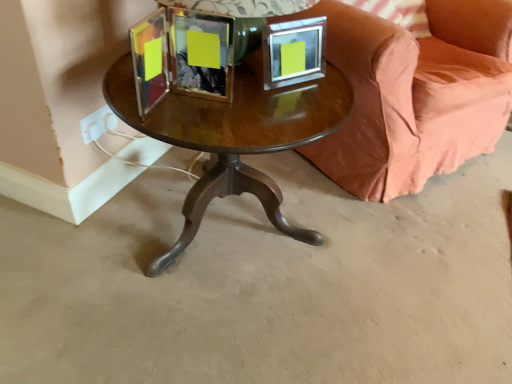
In order to face pink fabric pillow at upper right, should I rotate leftwards or rightwards?

To align with it, rotate right about 18.550°.

This screenshot has width=512, height=384. What do you see at coordinates (234, 137) in the screenshot? I see `shiny brown wood coffee table at center` at bounding box center [234, 137].

The height and width of the screenshot is (384, 512). Describe the element at coordinates (414, 93) in the screenshot. I see `velvet coral couch at center` at that location.

Where is `brown polished wood table at center`? This screenshot has width=512, height=384. brown polished wood table at center is located at coordinates (265, 285).

Where is `studio couch above the shiny brown wood coffee table at center (from a real-world perspective)`? Image resolution: width=512 pixels, height=384 pixels. studio couch above the shiny brown wood coffee table at center (from a real-world perspective) is located at coordinates (414, 93).

Looking at this image, visually, is velvet coral couch at center positioned to the left or to the right of shiny brown wood coffee table at center?

velvet coral couch at center is to the right of shiny brown wood coffee table at center.

Does velvet coral couch at center have a lesser width compared to shiny brown wood coffee table at center?

In fact, velvet coral couch at center might be wider than shiny brown wood coffee table at center.

Between shiny brown wood coffee table at center and metallic silver picture frame at upper center, which one has more height?

shiny brown wood coffee table at center is taller.

Is shiny brown wood coffee table at center not inside metallic silver picture frame at upper center?

Absolutely, shiny brown wood coffee table at center is external to metallic silver picture frame at upper center.

Between shiny brown wood coffee table at center and metallic silver picture frame at upper center, which one has smaller width?

Thinner between the two is metallic silver picture frame at upper center.

Considering the points (180, 142) and (297, 54), which point is in front, point (180, 142) or point (297, 54)?

Positioned in front is point (180, 142).

Can you confirm if pink fabric pillow at upper right is taller than brown polished wood table at center?

Yes.

Is point (375, 13) closer to camera compared to point (127, 331)?

No, it is behind (127, 331).

From a real-world perspective, between pink fabric pillow at upper right and brown polished wood table at center, who is vertically lower?

brown polished wood table at center.

Would you say velvet coral couch at center is inside or outside brown polished wood table at center?

velvet coral couch at center is spatially situated outside brown polished wood table at center.

Is velvet coral couch at center oriented towards brown polished wood table at center?

No, velvet coral couch at center does not turn towards brown polished wood table at center.

Is velvet coral couch at center at the left side of brown polished wood table at center?

Incorrect, velvet coral couch at center is not on the left side of brown polished wood table at center.

Measure the distance between velvet coral couch at center and brown polished wood table at center.

A distance of 18.50 inches exists between velvet coral couch at center and brown polished wood table at center.

Could you tell me if shiny brown wood coffee table at center is facing brown polished wood table at center?

No, shiny brown wood coffee table at center is not turned towards brown polished wood table at center.

Where is `coffee table that is on the left side of brown polished wood table at center`? Image resolution: width=512 pixels, height=384 pixels. coffee table that is on the left side of brown polished wood table at center is located at coordinates (234, 137).

Considering the relative sizes of shiny brown wood coffee table at center and brown polished wood table at center in the image provided, is shiny brown wood coffee table at center thinner than brown polished wood table at center?

Correct, the width of shiny brown wood coffee table at center is less than that of brown polished wood table at center.

Would you say shiny brown wood coffee table at center is a long distance from brown polished wood table at center?

That's not correct — shiny brown wood coffee table at center is a little close to brown polished wood table at center.

Is point (121, 281) positioned behind point (234, 193)?

No, (121, 281) is in front of (234, 193).

Find the location of `concrete lying below the shiny brown wood coffee table at center (from the image's perspective)`. concrete lying below the shiny brown wood coffee table at center (from the image's perspective) is located at coordinates (265, 285).

Between brown polished wood table at center and shiny brown wood coffee table at center, which one has larger width?

Wider between the two is brown polished wood table at center.

Is brown polished wood table at center inside the boundaries of shiny brown wood coffee table at center, or outside?

brown polished wood table at center is located beyond the bounds of shiny brown wood coffee table at center.

Is brown polished wood table at center oriented away from velvet coral couch at center?

No, velvet coral couch at center is not at the back of brown polished wood table at center.

From a real-world perspective, is brown polished wood table at center positioned above or below velvet coral couch at center?

brown polished wood table at center is situated lower than velvet coral couch at center in the real world.

Based on their positions, is brown polished wood table at center located to the left or right of velvet coral couch at center?

In the image, brown polished wood table at center appears on the left side of velvet coral couch at center.

Where is `studio couch above the brown polished wood table at center (from the image's perspective)`? The height and width of the screenshot is (384, 512). studio couch above the brown polished wood table at center (from the image's perspective) is located at coordinates (414, 93).

At what (x,y) coordinates should I click in order to perform the action: click on studio couch above the shiny brown wood coffee table at center (from a real-world perspective). Please return your answer as a coordinate pair (x, y). Looking at the image, I should click on (414, 93).

The width and height of the screenshot is (512, 384). Find the location of `picture frame above the shiny brown wood coffee table at center (from the image's perspective)`. picture frame above the shiny brown wood coffee table at center (from the image's perspective) is located at coordinates (294, 52).

Estimate the real-world distances between objects in this image. Which object is further from metallic silver picture frame at upper center, shiny brown wood coffee table at center or pink fabric pillow at upper right?

The object further to metallic silver picture frame at upper center is pink fabric pillow at upper right.

Estimate the real-world distances between objects in this image. Which object is further from velvet coral couch at center, shiny brown wood coffee table at center or metallic silver picture frame at upper center?

shiny brown wood coffee table at center lies further to velvet coral couch at center than the other object.

Based on their spatial positions, is velvet coral couch at center or shiny brown wood coffee table at center further from brown polished wood table at center?

shiny brown wood coffee table at center is further to brown polished wood table at center.

Based on their spatial positions, is shiny brown wood coffee table at center or metallic silver picture frame at upper center further from brown polished wood table at center?

metallic silver picture frame at upper center is positioned further to the anchor brown polished wood table at center.

From the image, which object appears to be farther from velvet coral couch at center, shiny brown wood coffee table at center or pink fabric pillow at upper right?

Among the two, shiny brown wood coffee table at center is located further to velvet coral couch at center.

Which object lies nearer to the anchor point pink fabric pillow at upper right, shiny brown wood coffee table at center or velvet coral couch at center?

velvet coral couch at center lies closer to pink fabric pillow at upper right than the other object.

Looking at the image, which one is located further to velvet coral couch at center, brown polished wood table at center or metallic silver picture frame at upper center?

Among the two, metallic silver picture frame at upper center is located further to velvet coral couch at center.

Which object lies nearer to the anchor point metallic silver picture frame at upper center, velvet coral couch at center or shiny brown wood coffee table at center?

shiny brown wood coffee table at center lies closer to metallic silver picture frame at upper center than the other object.

The height and width of the screenshot is (384, 512). Identify the location of picture frame between velvet coral couch at center and brown polished wood table at center in the vertical direction. point(294,52).

Where is `coffee table between brown polished wood table at center and metallic silver picture frame at upper center from front to back`? coffee table between brown polished wood table at center and metallic silver picture frame at upper center from front to back is located at coordinates pos(234,137).

Identify the location of coffee table between brown polished wood table at center and pink fabric pillow at upper right in the front-back direction. This screenshot has height=384, width=512. (234, 137).

Where is `picture frame positioned between brown polished wood table at center and pink fabric pillow at upper right from near to far`? Image resolution: width=512 pixels, height=384 pixels. picture frame positioned between brown polished wood table at center and pink fabric pillow at upper right from near to far is located at coordinates (294, 52).